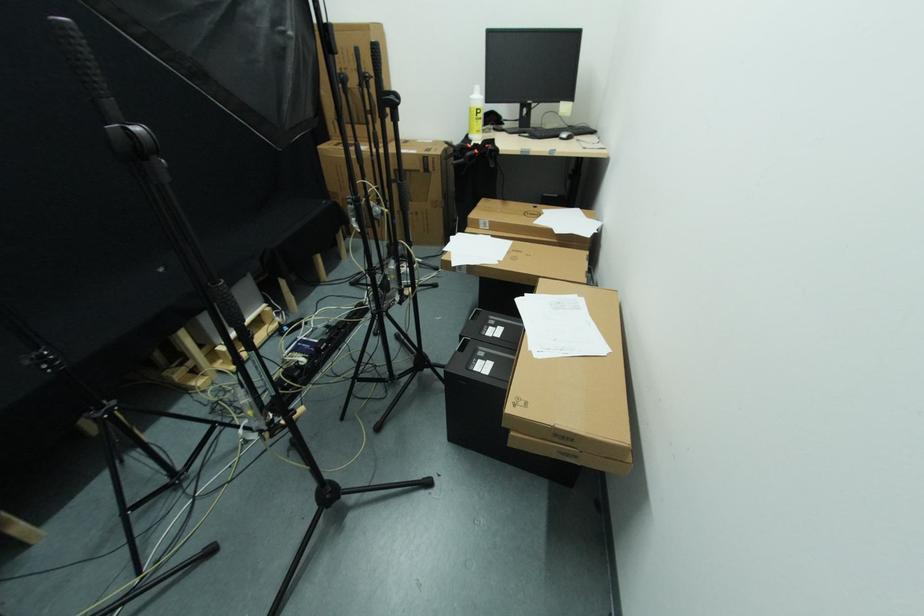
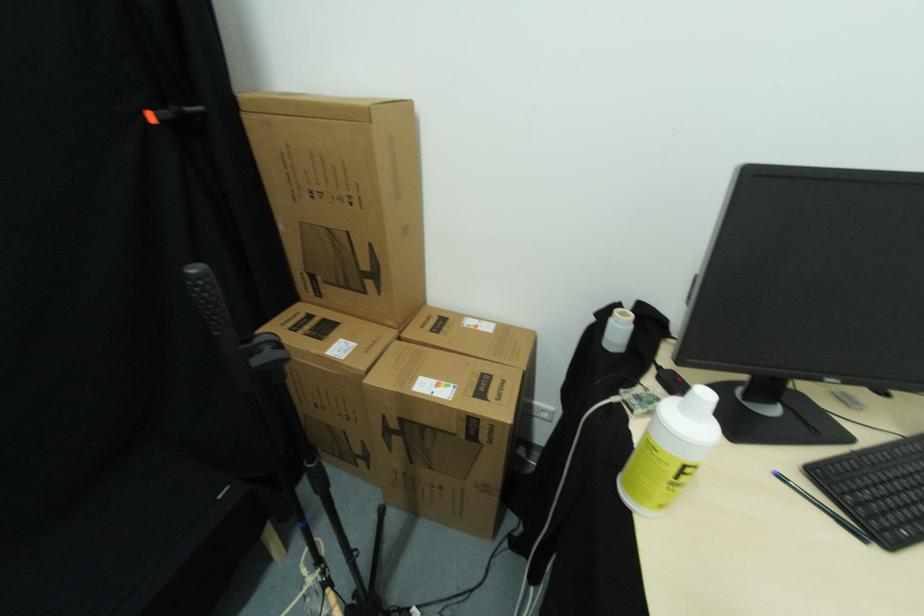
Question: In a continuous first-person perspective shot, in which direction is the camera moving?

Choices:
 (A) Left
 (B) Right
 (C) Forward
 (D) Backward

Answer: (C)